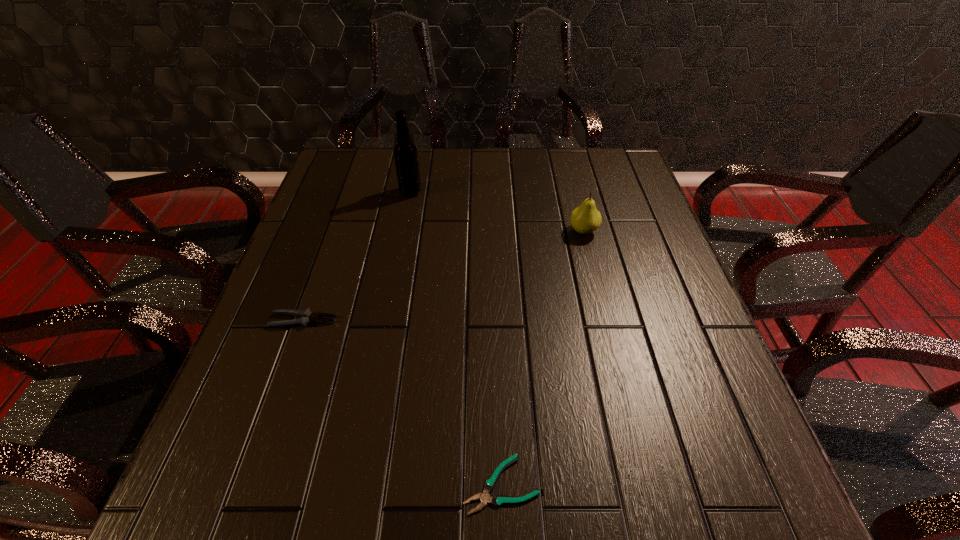
At what (x,y) coordinates should I click in order to perform the action: click on vacant space at the far right corner of the desktop. Please return your answer as a coordinate pair (x, y). The image size is (960, 540). Looking at the image, I should click on (624, 151).

The width and height of the screenshot is (960, 540). Identify the location of free space at the near right corner of the desktop. (700, 487).

At what (x,y) coordinates should I click in order to perform the action: click on free space between the beer bottle and the second farthest object. Please return your answer as a coordinate pair (x, y). Image resolution: width=960 pixels, height=540 pixels. Looking at the image, I should click on (497, 211).

Image resolution: width=960 pixels, height=540 pixels. I want to click on vacant space that is in between the tallest object and the farther pliers, so click(357, 256).

Where is `vacant space that is in between the rightmost object and the tallest object`? The width and height of the screenshot is (960, 540). vacant space that is in between the rightmost object and the tallest object is located at coordinates (497, 211).

Where is `free space between the farthest object and the third farthest object`? Image resolution: width=960 pixels, height=540 pixels. free space between the farthest object and the third farthest object is located at coordinates (357, 256).

Locate an element on the screen. free space between the farther pliers and the shortest object is located at coordinates (402, 402).

The width and height of the screenshot is (960, 540). I want to click on unoccupied position between the pear and the left pliers, so click(x=444, y=275).

At what (x,y) coordinates should I click in order to perform the action: click on free space between the second shortest object and the nearest object. Please return your answer as a coordinate pair (x, y). The height and width of the screenshot is (540, 960). Looking at the image, I should click on (402, 402).

At what (x,y) coordinates should I click in order to perform the action: click on free space between the left pliers and the farthest object. Please return your answer as a coordinate pair (x, y). This screenshot has width=960, height=540. Looking at the image, I should click on (357, 256).